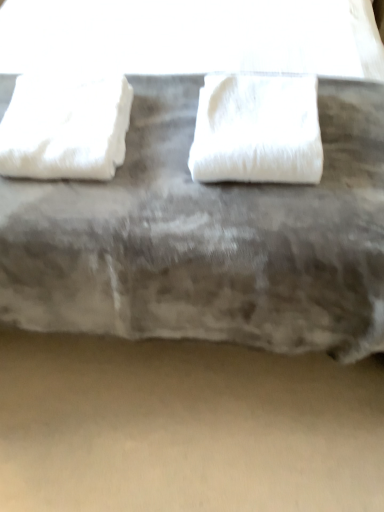
What is the approximate width of white fabric at center?

It is 2.34 meters.

What do you see at coordinates (207, 238) in the screenshot?
I see `white fabric at center` at bounding box center [207, 238].

This screenshot has width=384, height=512. What are the coordinates of `white fluffy towel at center, the 1th towel from the right` in the screenshot? It's located at (257, 130).

Identify the location of beige matte concrete at lower center. (185, 426).

The height and width of the screenshot is (512, 384). Describe the element at coordinates (185, 426) in the screenshot. I see `beige matte concrete at lower center` at that location.

Locate an element on the screen. Image resolution: width=384 pixels, height=512 pixels. white fluffy towel at left, which ranks as the 2th towel in right-to-left order is located at coordinates (65, 128).

Locate an element on the screen. The width and height of the screenshot is (384, 512). white fabric at center is located at coordinates (207, 238).

Is beige matte concrete at lower center wider or thinner than white fluffy towel at left, which ranks as the 2th towel in right-to-left order?

Clearly, beige matte concrete at lower center has more width compared to white fluffy towel at left, which ranks as the 2th towel in right-to-left order.

Is the surface of beige matte concrete at lower center in direct contact with white fluffy towel at left, which ranks as the 2th towel in right-to-left order?

No, beige matte concrete at lower center is not making contact with white fluffy towel at left, which ranks as the 2th towel in right-to-left order.

Can you tell me how much beige matte concrete at lower center and white fluffy towel at left, which ranks as the 2th towel in right-to-left order, differ in facing direction?

The facing directions of beige matte concrete at lower center and white fluffy towel at left, which ranks as the 2th towel in right-to-left order, are 87.2 degrees apart.

Can you confirm if beige matte concrete at lower center is positioned to the right of white fluffy towel at left, which ranks as the 2th towel in right-to-left order?

Correct, you'll find beige matte concrete at lower center to the right of white fluffy towel at left, which ranks as the 2th towel in right-to-left order.

In the scene shown: Is white fabric at center next to white fluffy towel at center, the 1th towel from the right, and touching it?

No.

Is white fluffy towel at center, the 1th towel from the right, completely or partially inside white fabric at center?

Yes, white fluffy towel at center, the 1th towel from the right, is a part of white fabric at center.

At what (x,y) coordinates should I click in order to perform the action: click on towel that is the 1st object located behind the white fabric at center. Please return your answer as a coordinate pair (x, y). Looking at the image, I should click on (257, 130).

How much distance is there between white fabric at center and white fluffy towel at center, the 1th towel from the right?

white fabric at center is 7.27 inches away from white fluffy towel at center, the 1th towel from the right.

Based on their sizes in the image, would you say white fluffy towel at left, the first towel positioned from the left, is bigger or smaller than white fabric at center?

white fluffy towel at left, the first towel positioned from the left, is smaller than white fabric at center.

Is white fluffy towel at left, the first towel positioned from the left, completely or partially outside of white fabric at center?

No, most part of white fluffy towel at left, the first towel positioned from the left, lies within white fabric at center.

Is white fluffy towel at left, the first towel positioned from the left, with white fabric at center?

white fluffy towel at left, the first towel positioned from the left, and white fabric at center are not in contact.

From a real-world perspective, is white fabric at center positioned under white fluffy towel at left, the first towel positioned from the left, based on gravity?

No, from a real-world perspective, white fabric at center is not below white fluffy towel at left, the first towel positioned from the left.

Which object is closer to the camera taking this photo, white fabric at center or white fluffy towel at left, the first towel positioned from the left?

white fabric at center is in front.

Can you confirm if white fabric at center is bigger than white fluffy towel at left, which ranks as the 2th towel in right-to-left order?

Yes.

Can you confirm if white fabric at center is positioned to the left of white fluffy towel at left, which ranks as the 2th towel in right-to-left order?

Incorrect, white fabric at center is not on the left side of white fluffy towel at left, which ranks as the 2th towel in right-to-left order.

From the image's perspective, which is above, beige matte concrete at lower center or white fabric at center?

white fabric at center is shown above in the image.

Is beige matte concrete at lower center bigger or smaller than white fabric at center?

beige matte concrete at lower center is smaller than white fabric at center.

Is beige matte concrete at lower center in contact with white fabric at center?

No, beige matte concrete at lower center is not making contact with white fabric at center.

From a real-world perspective, which object rests below the other?

white fluffy towel at left, which ranks as the 2th towel in right-to-left order, is physically lower.

Can you tell me how much white fluffy towel at center, the 1th towel from the right, and white fluffy towel at left, which ranks as the 2th towel in right-to-left order, differ in facing direction?

They differ by 3.05 degrees in their facing directions.

Does point (223, 179) lie in front of point (56, 92)?

Yes, it is.

Looking at their sizes, would you say white fluffy towel at center, acting as the second towel starting from the left, is wider or thinner than white fluffy towel at left, which ranks as the 2th towel in right-to-left order?

white fluffy towel at center, acting as the second towel starting from the left, is thinner than white fluffy towel at left, which ranks as the 2th towel in right-to-left order.

From a real-world perspective, which object stands above the other?

In real-world perspective, white fabric at center is above.

Between white fabric at center and beige matte concrete at lower center, which one appears on the left side from the viewer's perspective?

white fabric at center is more to the left.

How far apart are white fabric at center and beige matte concrete at lower center?

A distance of 40.49 centimeters exists between white fabric at center and beige matte concrete at lower center.

Find the location of a particular element. This screenshot has width=384, height=512. towel that is the 1st one above the beige matte concrete at lower center (from a real-world perspective) is located at coordinates (65, 128).

Find the location of a particular element. The width and height of the screenshot is (384, 512). the 1st towel behind the white fabric at center, starting your count from the anchor is located at coordinates (257, 130).

From the image, which object appears to be farther from beige matte concrete at lower center, white fluffy towel at center, the 1th towel from the right, or white fluffy towel at left, the first towel positioned from the left?

white fluffy towel at left, the first towel positioned from the left.

When comparing their distances from white fluffy towel at center, acting as the second towel starting from the left, does beige matte concrete at lower center or white fabric at center seem further?

beige matte concrete at lower center is further to white fluffy towel at center, acting as the second towel starting from the left.

From the image, which object appears to be farther from white fabric at center, white fluffy towel at center, the 1th towel from the right, or beige matte concrete at lower center?

Based on the image, beige matte concrete at lower center appears to be further to white fabric at center.

Considering their positions, is white fabric at center positioned further to white fluffy towel at left, which ranks as the 2th towel in right-to-left order, than white fluffy towel at center, the 1th towel from the right?

white fluffy towel at center, the 1th towel from the right.

Considering their positions, is white fabric at center positioned further to white fluffy towel at center, acting as the second towel starting from the left, than beige matte concrete at lower center?

Among the two, beige matte concrete at lower center is located further to white fluffy towel at center, acting as the second towel starting from the left.

Looking at the image, which one is located further to white fluffy towel at left, which ranks as the 2th towel in right-to-left order, beige matte concrete at lower center or white fluffy towel at center, acting as the second towel starting from the left?

beige matte concrete at lower center.

When comparing their distances from white fabric at center, does white fluffy towel at left, the first towel positioned from the left, or beige matte concrete at lower center seem closer?

Among the two, white fluffy towel at left, the first towel positioned from the left, is located nearer to white fabric at center.

Which object lies further to the anchor point white fluffy towel at center, acting as the second towel starting from the left, white fluffy towel at left, the first towel positioned from the left, or beige matte concrete at lower center?

beige matte concrete at lower center lies further to white fluffy towel at center, acting as the second towel starting from the left, than the other object.

This screenshot has height=512, width=384. I want to click on towel between white fluffy towel at left, the first towel positioned from the left, and beige matte concrete at lower center vertically, so click(x=257, y=130).

This screenshot has width=384, height=512. Identify the location of towel positioned between white fabric at center and white fluffy towel at left, the first towel positioned from the left, from near to far. (257, 130).